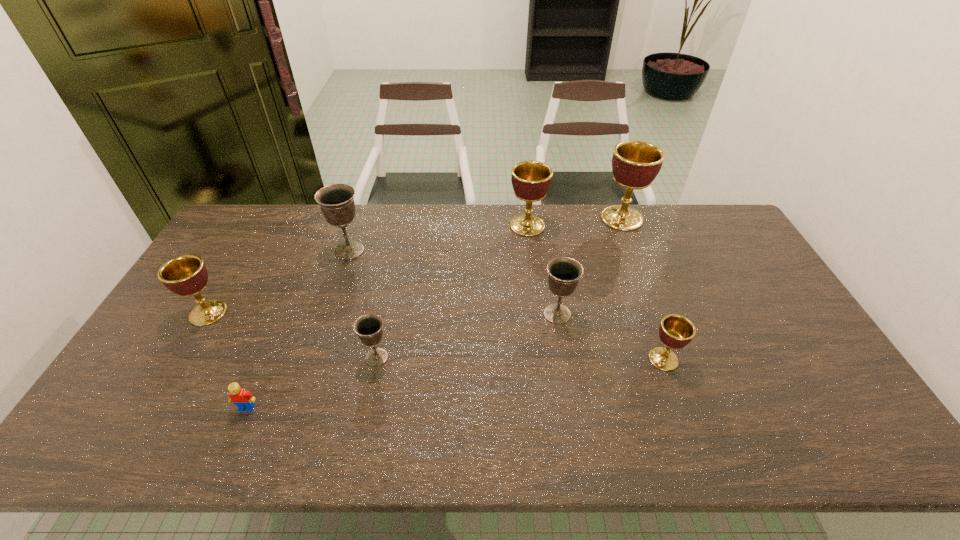
The image size is (960, 540). In order to click on free space between the second biggest bronze chalice and the third object from left to right in this screenshot , I will do `click(453, 282)`.

The image size is (960, 540). Identify the location of vacant region between the biggest bronze chalice and the second golden chalice from left to right. (439, 238).

Identify the location of free spot between the second golden chalice from left to right and the leftmost chalice. (368, 269).

Where is `vacant space that is in between the shortest object and the sixth object from right to left`? The image size is (960, 540). vacant space that is in between the shortest object and the sixth object from right to left is located at coordinates (299, 329).

Where is `free space that is in between the red Lego and the tallest chalice`? Image resolution: width=960 pixels, height=540 pixels. free space that is in between the red Lego and the tallest chalice is located at coordinates (434, 313).

At what (x,y) coordinates should I click in order to perform the action: click on vacant space that is in between the rightmost bronze chalice and the nearest golden chalice. Please return your answer as a coordinate pair (x, y). This screenshot has height=540, width=960. Looking at the image, I should click on coord(611,336).

Find the location of `unoccupied area between the smallest golden chalice and the second bronze chalice from right to left`. unoccupied area between the smallest golden chalice and the second bronze chalice from right to left is located at coordinates (520, 358).

The height and width of the screenshot is (540, 960). I want to click on object that stands as the second closest to the second object from left to right, so click(x=186, y=276).

At what (x,y) coordinates should I click in order to perform the action: click on object that is the seventh closest to the tallest object. Please return your answer as a coordinate pair (x, y). Looking at the image, I should click on (186, 276).

At what (x,y) coordinates should I click in order to perform the action: click on chalice that is the fifth closest to the tallest object. Please return your answer as a coordinate pair (x, y). Looking at the image, I should click on (368, 327).